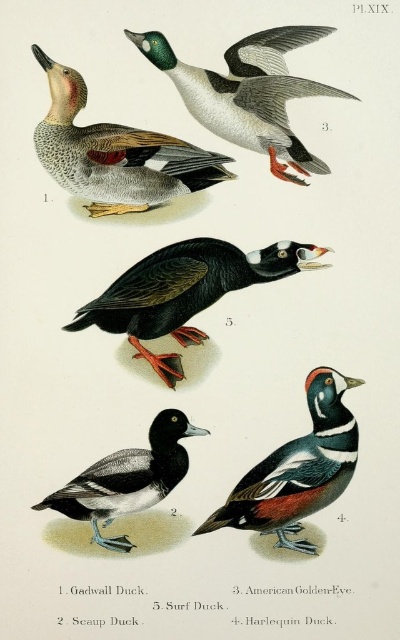
Question: Is green glossy duck at upper center smaller than multicolored feathered duck at lower right?

Choices:
 (A) no
 (B) yes

Answer: (A)

Question: Which point is closer to the camera?

Choices:
 (A) (70, 122)
 (B) (308, 257)
 (C) (57, 499)
 (D) (229, 68)

Answer: (C)

Question: Observing the image, what is the correct spatial positioning of green glossy duck at upper center in reference to multicolored feathered duck at lower right?

Choices:
 (A) above
 (B) below

Answer: (A)

Question: Among these points, which one is farthest from the camera?

Choices:
 (A) (116, 541)
 (B) (295, 147)
 (C) (162, 257)
 (D) (133, 164)

Answer: (C)

Question: Estimate the real-world distances between objects in this image. Which object is farther from the multicolored feathered duck at lower right?

Choices:
 (A) black glossy surf duck at center
 (B) black glossy duck at center

Answer: (A)

Question: Is multicolored feathered duck at lower right wider than black glossy duck at center?

Choices:
 (A) yes
 (B) no

Answer: (B)